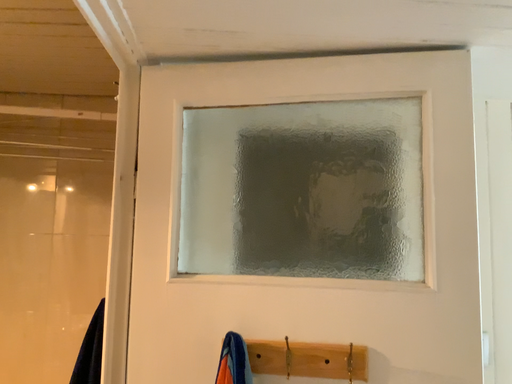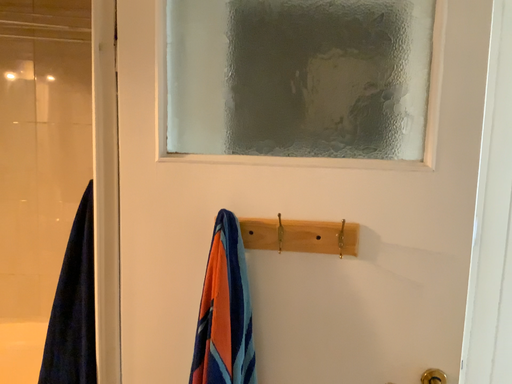
Question: Which way did the camera rotate in the video?

Choices:
 (A) rotated upward
 (B) rotated downward

Answer: (B)